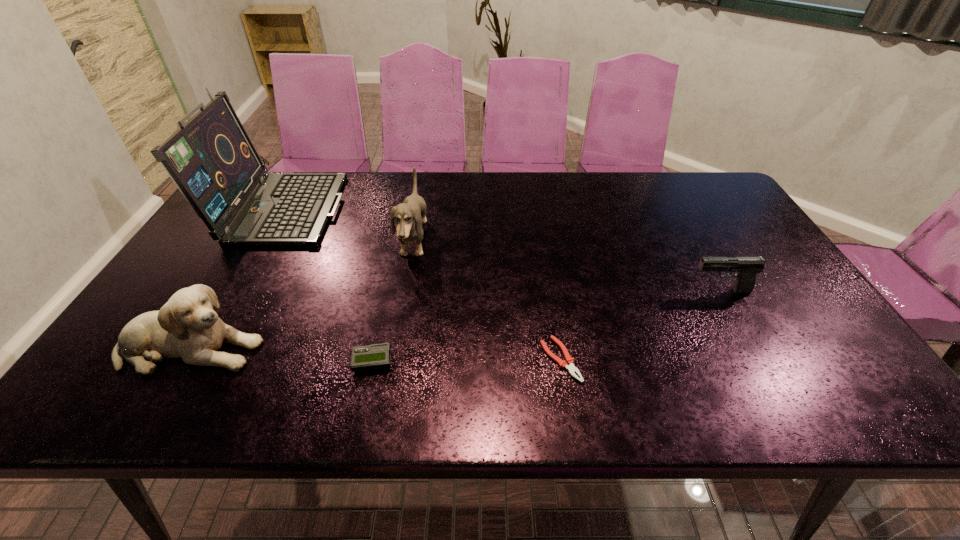
At what (x,y) coordinates should I click in order to perform the action: click on the tallest object. Please return your answer as a coordinate pair (x, y). Looking at the image, I should click on (210, 158).

Where is `the farther puppy`? The height and width of the screenshot is (540, 960). the farther puppy is located at coordinates (409, 215).

Image resolution: width=960 pixels, height=540 pixels. Identify the location of the nearer puppy. (187, 327).

This screenshot has width=960, height=540. I want to click on the fourth nearest object, so click(746, 267).

Identify the location of pistol. (746, 267).

This screenshot has width=960, height=540. Identify the location of the second shortest object. (375, 356).

You are a GUI agent. You are given a task and a screenshot of the screen. Output one action in this format:
    pyautogui.click(x=<x>, y=<y>)
    Task: Click on the fifth object from left to right
    
    Given the screenshot: What is the action you would take?
    pyautogui.click(x=569, y=363)

Identify the location of pliers. The height and width of the screenshot is (540, 960). (569, 363).

Identify the location of vacant space located on the front-facing side of the laptop computer. (434, 206).

Find the location of a particular element. Image resolution: width=960 pixels, height=540 pixels. free space located at the face of the right puppy is located at coordinates (452, 241).